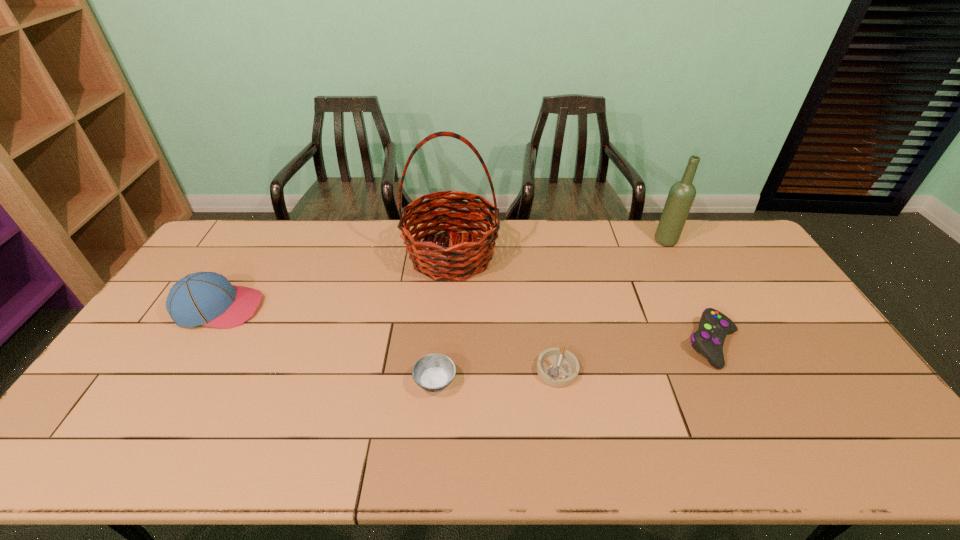
Image resolution: width=960 pixels, height=540 pixels. In order to click on vacant point located between the control and the right ashtray in this screenshot , I will do `click(636, 357)`.

The image size is (960, 540). I want to click on empty space that is in between the fifth tallest object and the leftmost object, so click(327, 345).

In order to click on the fifth closest object to the left ashtray in this screenshot , I will do `click(682, 194)`.

This screenshot has height=540, width=960. Find the location of `object that stands as the second closest to the fourth shortest object`. object that stands as the second closest to the fourth shortest object is located at coordinates (434, 372).

At what (x,y) coordinates should I click in order to perform the action: click on free space in the image that satisfies the following two spatial constraints: 1. on the front-facing side of the leftmost object; 2. on the back side of the control. Please return your answer as a coordinate pair (x, y). The height and width of the screenshot is (540, 960). Looking at the image, I should click on (197, 344).

Identify the location of vacant area that satisfies the following two spatial constraints: 1. on the front-facing side of the right ashtray; 2. on the left side of the third tallest object. The image size is (960, 540). (181, 370).

You are a GUI agent. You are given a task and a screenshot of the screen. Output one action in this format:
    pyautogui.click(x=<x>, y=<y>)
    Task: Click on the free space that satisfies the following two spatial constraints: 1. on the front-facing side of the leftmost object; 2. on the right side of the second shortest object
    The width and height of the screenshot is (960, 540).
    Given the screenshot: What is the action you would take?
    pyautogui.click(x=174, y=382)

Find the location of a particular element. vacant region that satisfies the following two spatial constraints: 1. on the handle side of the fourth tallest object; 2. on the left side of the basket is located at coordinates (445, 344).

Where is `vacant space that satisfies the following two spatial constraints: 1. on the handle side of the right ashtray; 2. on the left side of the tallest object`? The height and width of the screenshot is (540, 960). vacant space that satisfies the following two spatial constraints: 1. on the handle side of the right ashtray; 2. on the left side of the tallest object is located at coordinates (443, 370).

Where is `free spot that satisfies the following two spatial constraints: 1. on the back side of the second tallest object; 2. on the left side of the control`? The width and height of the screenshot is (960, 540). free spot that satisfies the following two spatial constraints: 1. on the back side of the second tallest object; 2. on the left side of the control is located at coordinates (661, 241).